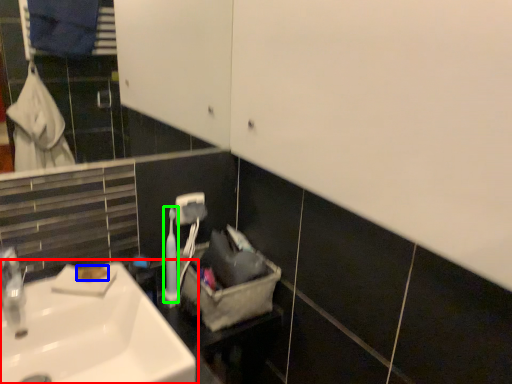
Question: Which object is positioned farthest from sink (highlighted by a red box)? Select from soap (highlighted by a blue box) and toiletry (highlighted by a green box).

Choices:
 (A) soap
 (B) toiletry

Answer: (B)